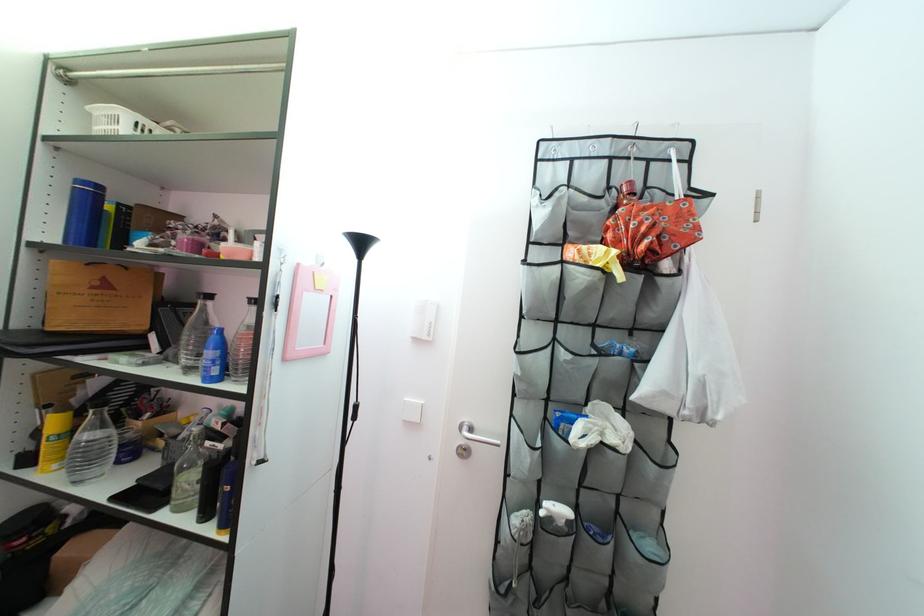
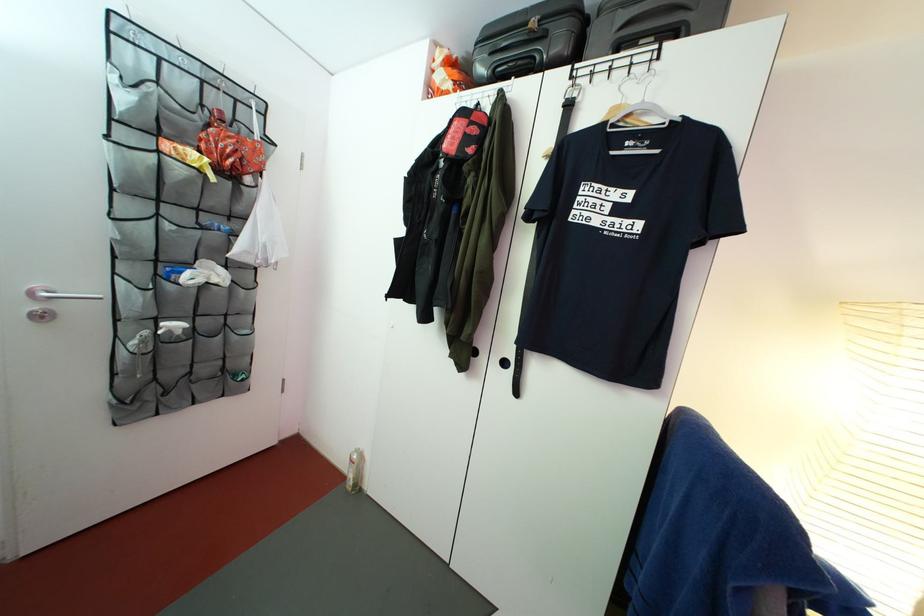
Question: The camera is either moving clockwise (left) or counter-clockwise (right) around the object. The first image is from the beginning of the video and the second image is from the end. Is the camera moving left or right when shooting the video?

Choices:
 (A) Left
 (B) Right

Answer: (A)